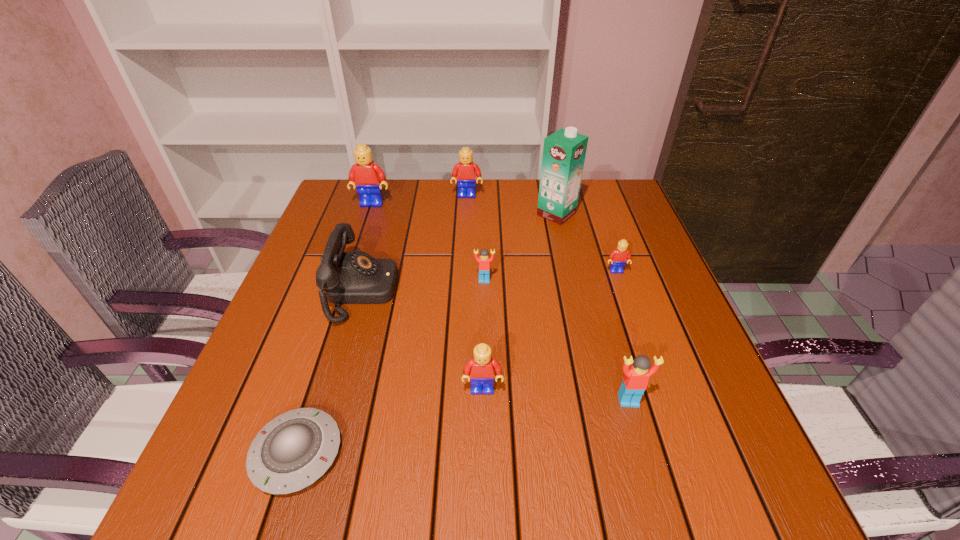
At what (x,y) coordinates should I click in order to perform the action: click on carton. Please return your answer as a coordinate pair (x, y). Looking at the image, I should click on (564, 151).

The width and height of the screenshot is (960, 540). Identify the location of the biggest yellow Lego. (365, 175).

At what (x,y) coordinates should I click in order to perform the action: click on the fifth nearest Lego. Please return your answer as a coordinate pair (x, y). Image resolution: width=960 pixels, height=540 pixels. Looking at the image, I should click on (365, 175).

You are a GUI agent. You are given a task and a screenshot of the screen. Output one action in this format:
    pyautogui.click(x=<x>, y=<y>)
    Task: Click on the farthest yellow Lego
    The width and height of the screenshot is (960, 540).
    Given the screenshot: What is the action you would take?
    pyautogui.click(x=466, y=171)

Locate an element on the screen. This screenshot has width=960, height=540. the farthest object is located at coordinates (466, 171).

Identify the location of gray telephone. This screenshot has width=960, height=540. (356, 277).

You are a GUI agent. You are given a task and a screenshot of the screen. Output one action in this format:
    pyautogui.click(x=<x>, y=<y>)
    Task: Click on the bigger red Lego
    Image resolution: width=960 pixels, height=540 pixels.
    Given the screenshot: What is the action you would take?
    pyautogui.click(x=636, y=378)

You are a GUI agent. You are given a task and a screenshot of the screen. Output one action in this format:
    pyautogui.click(x=<x>, y=<y>)
    Task: Click on the nearer red Lego
    
    Given the screenshot: What is the action you would take?
    pyautogui.click(x=636, y=378)

The image size is (960, 540). I want to click on the nearest yellow Lego, so click(481, 369).

Identify the location of the smaller red Lego. (484, 261).